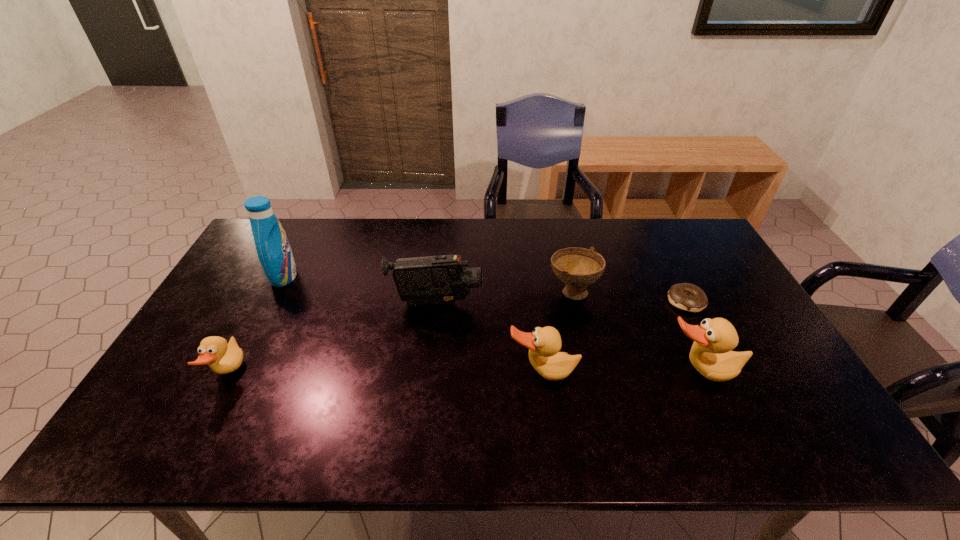
Where is `empty space between the second duck from right to left and the rightmost duck`? The image size is (960, 540). empty space between the second duck from right to left and the rightmost duck is located at coordinates (621, 373).

At what (x,y) coordinates should I click in order to perform the action: click on free space between the rightmost duck and the soup bowl. Please return your answer as a coordinate pair (x, y). Image resolution: width=960 pixels, height=540 pixels. Looking at the image, I should click on (636, 332).

I want to click on vacant point located between the third object from left to right and the second duck from right to left, so click(490, 338).

Find the location of a particular element. The height and width of the screenshot is (540, 960). object that stands as the third closest to the camcorder is located at coordinates (274, 252).

At what (x,y) coordinates should I click in order to perform the action: click on object that is the sixth closest to the detergent. Please return your answer as a coordinate pair (x, y). This screenshot has width=960, height=540. Looking at the image, I should click on (686, 296).

Find the location of `duck that stands as the closest to the detergent`. duck that stands as the closest to the detergent is located at coordinates [x=223, y=358].

Where is `duck object that ranks as the closest to the rightmost duck`? duck object that ranks as the closest to the rightmost duck is located at coordinates (544, 344).

Locate an element on the screen. This screenshot has height=540, width=960. free location that satisfies the following two spatial constraints: 1. on the front-facing side of the tallest object; 2. on the right side of the doughnut is located at coordinates (271, 301).

Image resolution: width=960 pixels, height=540 pixels. I want to click on free spot that satisfies the following two spatial constraints: 1. on the beak of the rightmost duck; 2. on the beak of the leftmost duck, so click(x=701, y=374).

I want to click on vacant space that satisfies the following two spatial constraints: 1. on the front-facing side of the tallest object; 2. on the left side of the soup bowl, so click(x=276, y=292).